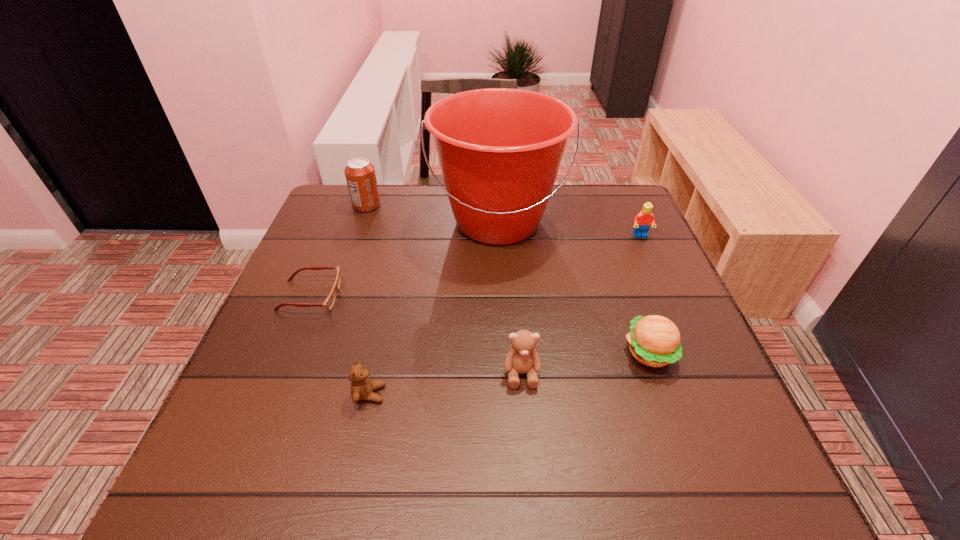
Find the location of a particular element. The height and width of the screenshot is (540, 960). free spot located on the right of the can is located at coordinates (453, 206).

I want to click on free spot located on the face of the Lego, so click(x=662, y=287).

Where is `free region located on the front-facing side of the taller teddy bear`? free region located on the front-facing side of the taller teddy bear is located at coordinates (531, 483).

Find the location of a particular element. This screenshot has width=960, height=540. vacant space situated 0.270m on the left of the hamburger is located at coordinates tap(490, 353).

Locate an element on the screen. The height and width of the screenshot is (540, 960). vacant region located 0.130m on the front-facing side of the left teddy bear is located at coordinates (455, 394).

This screenshot has height=540, width=960. Find the location of `free space located on the front-facing side of the fourth nearest object`. free space located on the front-facing side of the fourth nearest object is located at coordinates (419, 296).

You are a GUI agent. You are given a task and a screenshot of the screen. Output one action in this format:
    pyautogui.click(x=<x>, y=<y>)
    Task: Click on the bucket that is positioned at the far edge
    The height and width of the screenshot is (540, 960).
    Given the screenshot: What is the action you would take?
    pyautogui.click(x=500, y=149)

Image resolution: width=960 pixels, height=540 pixels. I want to click on can at the far edge, so click(x=360, y=175).

Image resolution: width=960 pixels, height=540 pixels. In order to click on can that is at the left edge in this screenshot , I will do `click(360, 175)`.

Where is `spectacles at the left edge`? spectacles at the left edge is located at coordinates pyautogui.click(x=329, y=302).